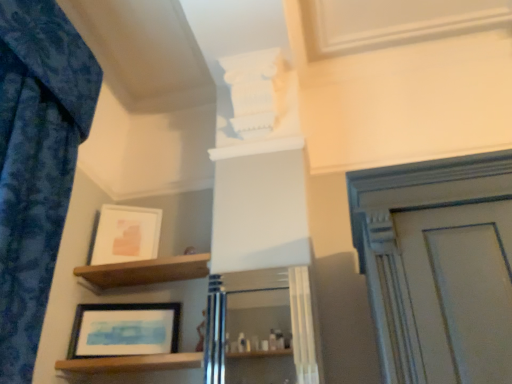
Question: From the image's perspective, is brown wooden shelf at upper center, the 2th shelf when ordered from bottom to top, on white glossy cabinet at center?

Choices:
 (A) yes
 (B) no

Answer: (A)

Question: Can you see brown wooden shelf at upper center, arranged as the first shelf when viewed from the top, touching white glossy cabinet at center?

Choices:
 (A) yes
 (B) no

Answer: (B)

Question: From the image's perspective, would you say brown wooden shelf at upper center, the 2th shelf when ordered from bottom to top, is shown under white glossy cabinet at center?

Choices:
 (A) yes
 (B) no

Answer: (B)

Question: Is brown wooden shelf at upper center, arranged as the first shelf when viewed from the top, smaller than white glossy cabinet at center?

Choices:
 (A) yes
 (B) no

Answer: (B)

Question: Considering the relative sizes of brown wooden shelf at upper center, arranged as the first shelf when viewed from the top, and white glossy cabinet at center in the image provided, is brown wooden shelf at upper center, arranged as the first shelf when viewed from the top, shorter than white glossy cabinet at center?

Choices:
 (A) yes
 (B) no

Answer: (A)

Question: Is brown wooden shelf at upper center, arranged as the first shelf when viewed from the top, to the right of white glossy cabinet at center from the viewer's perspective?

Choices:
 (A) no
 (B) yes

Answer: (A)

Question: Is blue fabric curtain at left taller than wooden at lower left, which is counted as the 2th shelf, starting from the top?

Choices:
 (A) no
 (B) yes

Answer: (B)

Question: Does blue fabric curtain at left have a lesser width compared to wooden at lower left, which appears as the first shelf when ordered from the bottom?

Choices:
 (A) yes
 (B) no

Answer: (B)

Question: Does blue fabric curtain at left have a lesser height compared to wooden at lower left, which appears as the first shelf when ordered from the bottom?

Choices:
 (A) no
 (B) yes

Answer: (A)

Question: Is the position of blue fabric curtain at left less distant than that of wooden at lower left, which appears as the first shelf when ordered from the bottom?

Choices:
 (A) no
 (B) yes

Answer: (B)

Question: Would you say blue fabric curtain at left contains wooden at lower left, which is counted as the 2th shelf, starting from the top?

Choices:
 (A) no
 (B) yes

Answer: (A)

Question: Is blue fabric curtain at left facing away from wooden at lower left, which appears as the first shelf when ordered from the bottom?

Choices:
 (A) no
 (B) yes

Answer: (A)

Question: Can you confirm if blue fabric curtain at left is smaller than matte white picture frame at upper left, which is the 1th picture frame in back-to-front order?

Choices:
 (A) yes
 (B) no

Answer: (B)